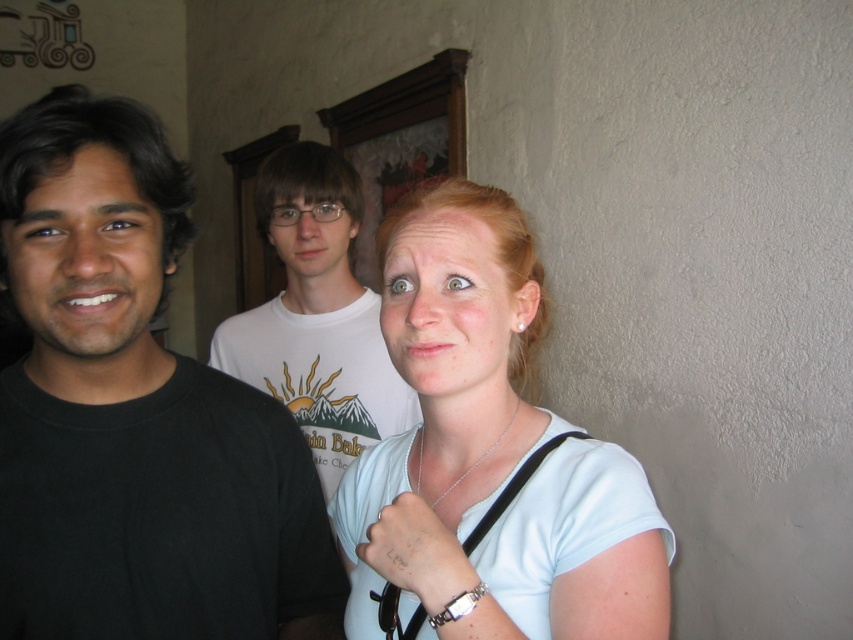
Question: Can you confirm if black matte shirt at left is positioned to the left of light blue fabric shirt at center?

Choices:
 (A) no
 (B) yes

Answer: (B)

Question: Can you confirm if light blue fabric shirt at center is positioned to the right of white t-shirt at center?

Choices:
 (A) no
 (B) yes

Answer: (B)

Question: Which point is farther to the camera?

Choices:
 (A) (283, 536)
 (B) (440, 353)

Answer: (A)

Question: Which point is closer to the camera?

Choices:
 (A) (277, 180)
 (B) (451, 572)

Answer: (B)

Question: Is light blue fabric shirt at center to the right of white t-shirt at center from the viewer's perspective?

Choices:
 (A) no
 (B) yes

Answer: (B)

Question: Which point is farther from the camera taking this photo?

Choices:
 (A) (254, 376)
 (B) (376, 552)

Answer: (A)